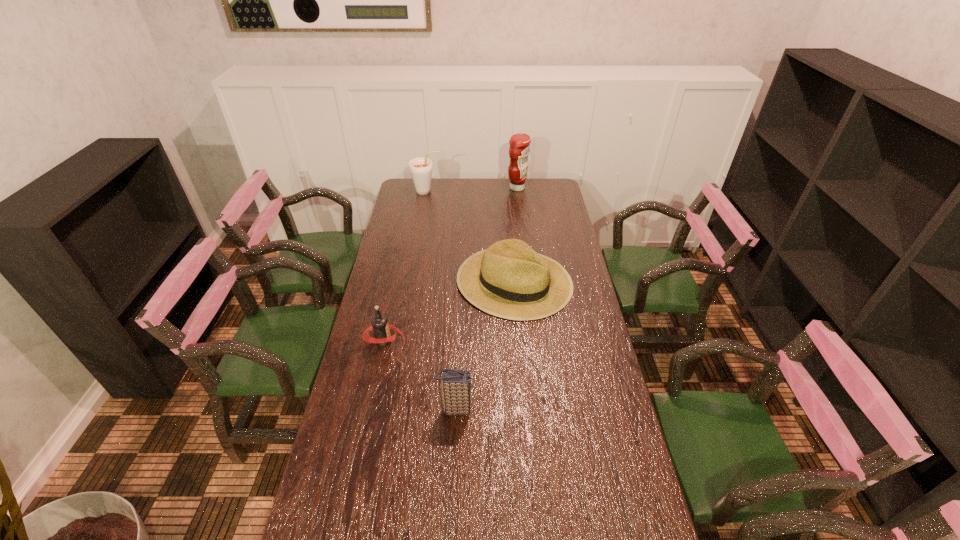
At what (x,y) coordinates should I click in order to perform the action: click on free space that satisfies the following two spatial constraints: 1. on the front side of the tallest object; 2. on the label of the second nearest object. Please return your answer as a coordinate pair (x, y). Looking at the image, I should click on (537, 341).